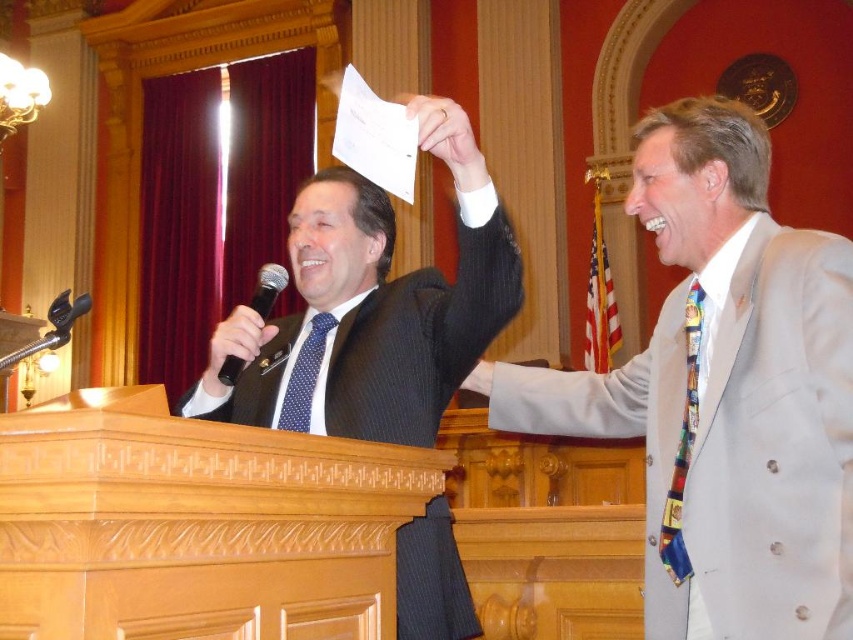
Is multicolored fabric tie at right to the left of black plastic microphone at left from the viewer's perspective?

Incorrect, multicolored fabric tie at right is not on the left side of black plastic microphone at left.

Between point (701, 292) and point (268, 296), which one is positioned in front?

Point (701, 292)

Which is behind, point (686, 422) or point (263, 300)?

The point (263, 300) is behind.

Where is `multicolored fabric tie at right`? The height and width of the screenshot is (640, 853). multicolored fabric tie at right is located at coordinates (683, 445).

Which is below, white paper at upper center or black plastic microphone at left?

Positioned lower is black plastic microphone at left.

The width and height of the screenshot is (853, 640). What do you see at coordinates (447, 138) in the screenshot?
I see `white paper at upper center` at bounding box center [447, 138].

Is point (474, 145) behind point (273, 284)?

No, (474, 145) is closer to viewer.

The image size is (853, 640). Identify the location of white paper at upper center. point(447,138).

Does point (498, 305) come farther from viewer compared to point (476, 365)?

No, (498, 305) is closer to viewer.

Who is lower down, matte black suit at center or smooth leather hand at upper right?

smooth leather hand at upper right is lower down.

The image size is (853, 640). I want to click on matte black suit at center, so click(x=370, y=317).